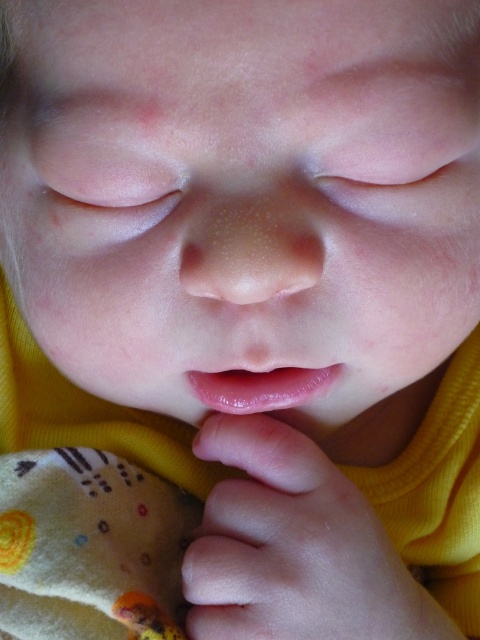
You are a pediatric nurse examining a baby. You notice the pink smooth skin at lower center and the clear plastic teething ring at lower center in the image. Which object is closer to the camera?

The pink smooth skin at lower center is in front of the clear plastic teething ring at lower center, so the pink smooth skin is closer to the camera.

You are a pediatric nurse checking the baby for potential health issues. You notice the pink smooth skin at lower center and the clear plastic teething ring at lower center. Based on the distance between them, can the baby safely reach the clear plastic teething ring with their mouth?

The pink smooth skin at lower center and clear plastic teething ring at lower center are 7.71 centimeters apart. Since the distance is within a typical reach for a baby of this age, the baby can safely reach the clear plastic teething ring at lower center with their mouth.